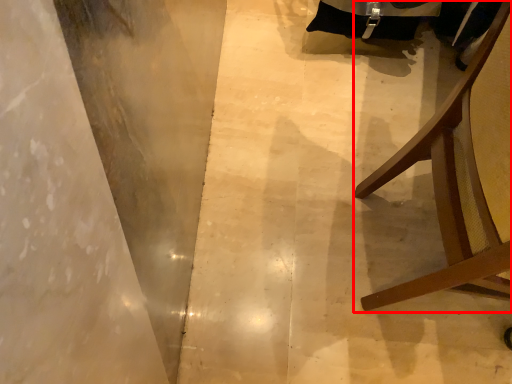
Question: Where is furniture (annotated by the red box) located in relation to concrete in the image?

Choices:
 (A) right
 (B) left

Answer: (A)